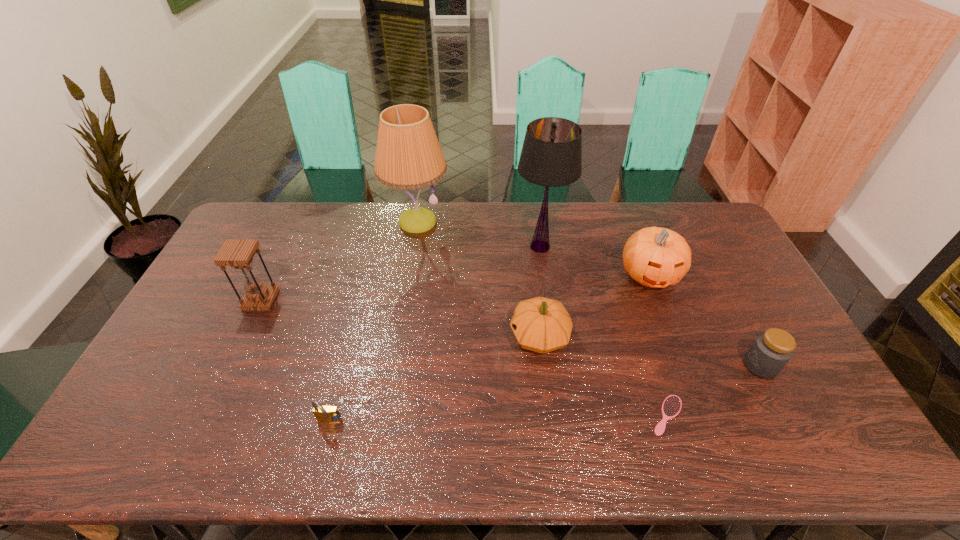
At what (x,y) coordinates should I click in order to perform the action: click on vacant space in between the lampshade and the padlock. Please return your answer as a coordinate pair (x, y). This screenshot has width=960, height=540. Looking at the image, I should click on (435, 334).

You are a GUI agent. You are given a task and a screenshot of the screen. Output one action in this format:
    pyautogui.click(x=<x>, y=<y>)
    Task: Click on the vacant space that's between the shortest object and the second shortest object
    
    Given the screenshot: What is the action you would take?
    pyautogui.click(x=498, y=418)

Locate an element on the screen. The width and height of the screenshot is (960, 540). object that stands as the third closest to the padlock is located at coordinates (408, 156).

Locate which object ranks fourth in proximity to the gourd. Please provide its 2D coordinates. Your answer should be formatted as a tuple, i.e. [(x, y)], where the tuple contains the x and y coordinates of a point satisfying the conditions above.

[(408, 156)]

This screenshot has width=960, height=540. In order to click on vacant region that satisfies the following two spatial constraints: 1. on the surface of the rightmost object near the warning symbol; 2. on the side with the combination dials of the padlock in this screenshot , I will do `click(790, 422)`.

Find the location of a particular element. blank space that satisfies the following two spatial constraints: 1. on the front-facing side of the shortest object; 2. on the left side of the lampshade is located at coordinates (564, 415).

What are the coordinates of `vacant area in the image that satisfies the following two spatial constraints: 1. on the side of the shortest object with the carved face; 2. on the right side of the gourd` in the screenshot? It's located at (549, 415).

Identify the location of vacant space that satisfies the following two spatial constraints: 1. on the front-facing side of the lampshade; 2. on the back side of the shortest object. (x=564, y=415).

Where is `blank space that satisfies the following two spatial constraints: 1. on the side of the gourd with the carved face; 2. on the side with the combination dials of the second shortest object`? This screenshot has height=540, width=960. blank space that satisfies the following two spatial constraints: 1. on the side of the gourd with the carved face; 2. on the side with the combination dials of the second shortest object is located at coordinates (550, 422).